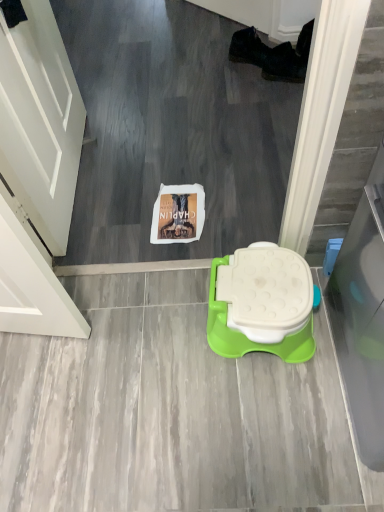
Locate an element on the screen. vacant area that lies in front of white plastic toilet at center is located at coordinates (255, 383).